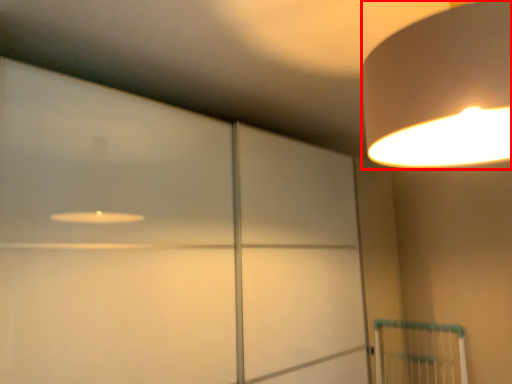
Question: From the image's perspective, where is lamp (annotated by the red box) located relative to glass door?

Choices:
 (A) below
 (B) above

Answer: (B)